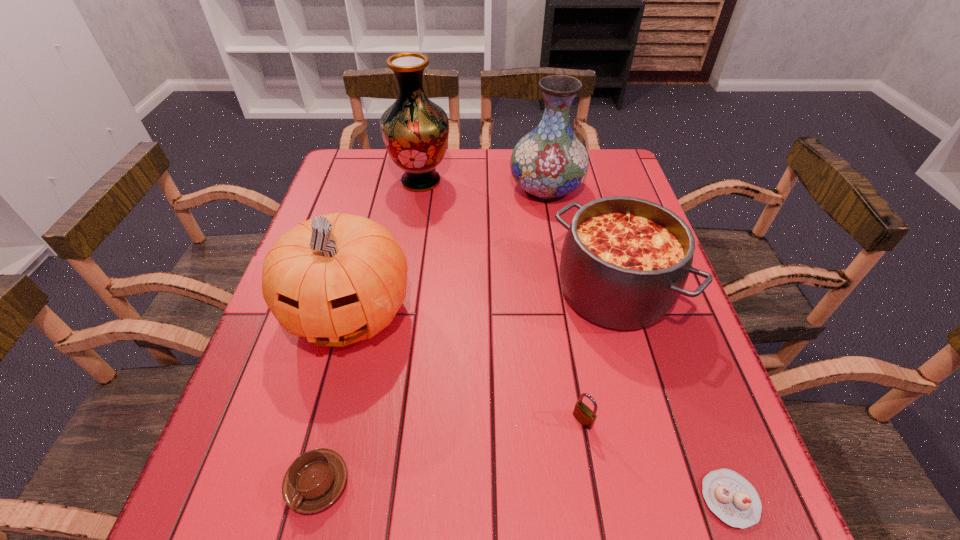
Image resolution: width=960 pixels, height=540 pixels. Find the location of `cupcake that is at the right edge`. cupcake that is at the right edge is located at coordinates (731, 497).

Locate an element on the screen. Image resolution: width=960 pixels, height=540 pixels. object that is at the near left corner is located at coordinates (315, 479).

Identify the location of object that is at the far right corner. This screenshot has height=540, width=960. (549, 162).

Identify the location of object that is at the near right corner. (731, 497).

The width and height of the screenshot is (960, 540). Identify the location of free space at the far edge. (450, 181).

This screenshot has height=540, width=960. In the image, there is a desktop. What are the coordinates of `vacant space at the near edge` in the screenshot? It's located at (483, 532).

You are a GUI agent. You are given a task and a screenshot of the screen. Output one action in this format:
    pyautogui.click(x=<x>, y=<y>)
    Task: Click on the vacant area at the left edge of the desktop
    This screenshot has width=960, height=540.
    Given the screenshot: What is the action you would take?
    pyautogui.click(x=267, y=351)

The image size is (960, 540). I want to click on free location at the right edge, so click(649, 376).

Identify the location of vacant space at the far left corner of the desktop. (348, 163).

The height and width of the screenshot is (540, 960). Identify the location of vacant space that's between the padlock and the casserole. (598, 356).